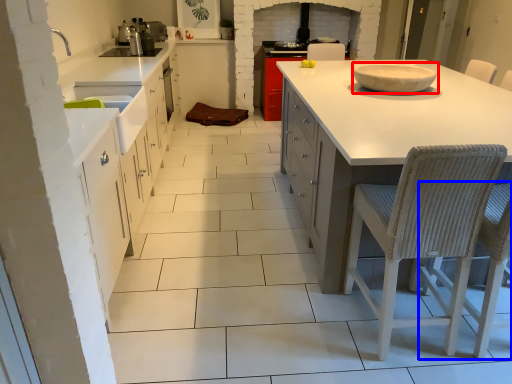
Question: Which object appears closest to the camera in this image, bowl (highlighted by a red box) or chair (highlighted by a blue box)?

Choices:
 (A) bowl
 (B) chair

Answer: (B)